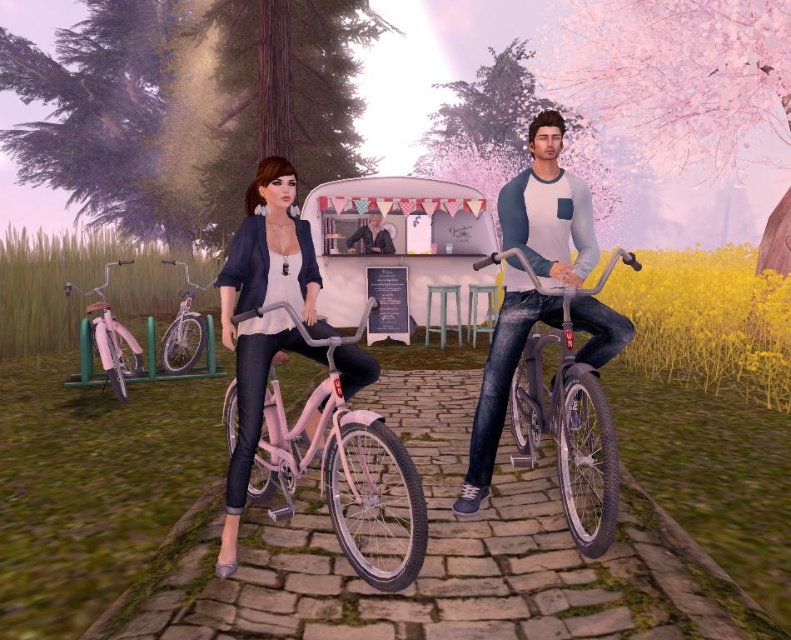
Question: Based on their relative distances, which object is farther from the smooth black jacket at center?

Choices:
 (A) matte pink bicycle at center
 (B) metallic pink bicycle at center

Answer: (A)

Question: Considering the relative positions of metallic pink bicycle at center and matte pink bicycle at center in the image provided, where is metallic pink bicycle at center located with respect to matte pink bicycle at center?

Choices:
 (A) below
 (B) above

Answer: (A)

Question: Which is farther from the shiny silver bicycle at left?

Choices:
 (A) pink matte bicycle at left
 (B) smooth black jacket at center

Answer: (B)

Question: Which of the following is the farthest from the observer?

Choices:
 (A) (369, 250)
 (B) (184, 355)
 (C) (241, 253)

Answer: (A)

Question: Is the position of pink matte bicycle at left less distant than that of shiny silver bicycle at left?

Choices:
 (A) yes
 (B) no

Answer: (B)

Question: Is pink matte bicycle at left positioned in front of shiny silver bicycle at left?

Choices:
 (A) no
 (B) yes

Answer: (A)